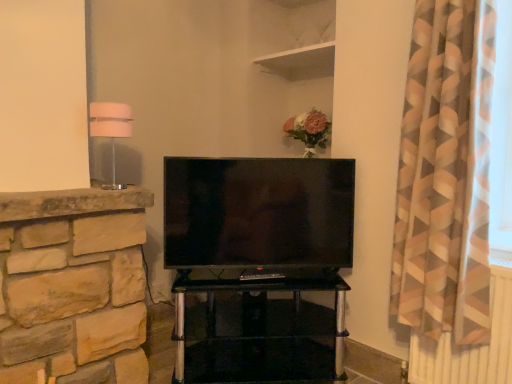
This screenshot has width=512, height=384. What are the coordinates of `vacant location below matte black tv at center (from a real-world perspective)` in the screenshot? It's located at (265, 274).